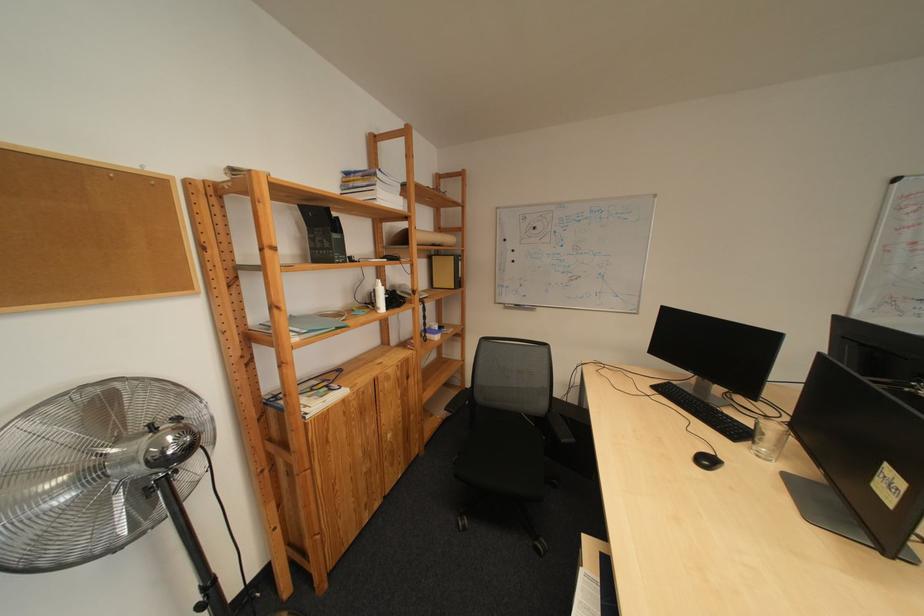
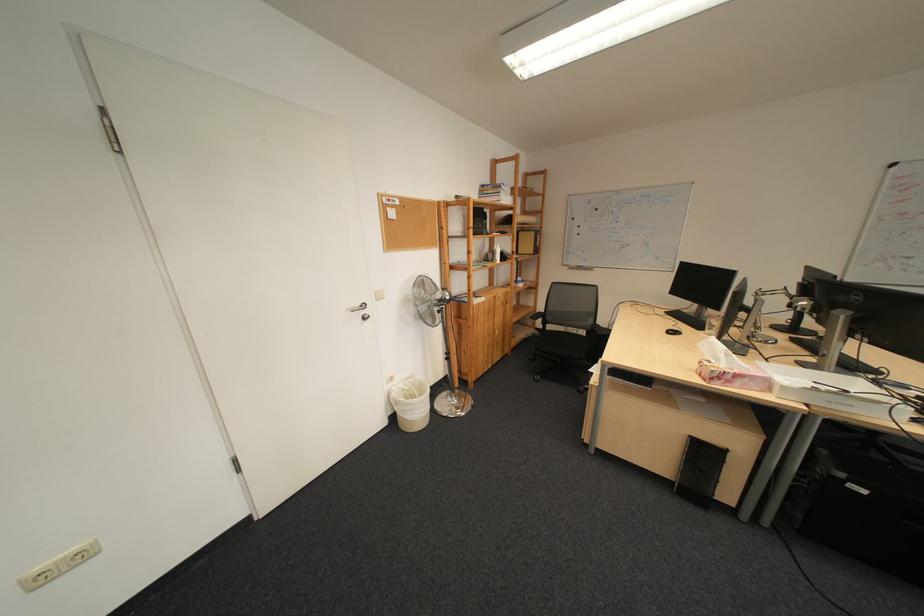
In the second image, find the point that corresponds to [365,302] in the first image.

(492, 257)